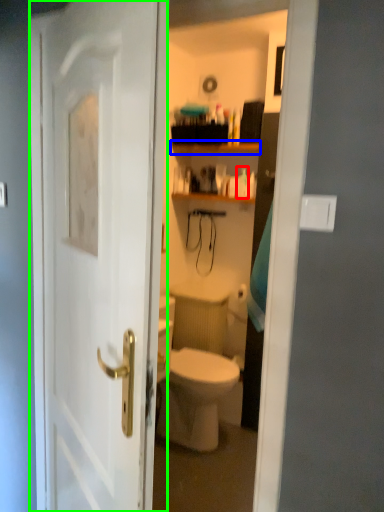
Question: Which object is positioned closest to toiletry (highlighted by a red box)? Select from shelf (highlighted by a blue box) and door (highlighted by a green box).

Choices:
 (A) shelf
 (B) door

Answer: (A)